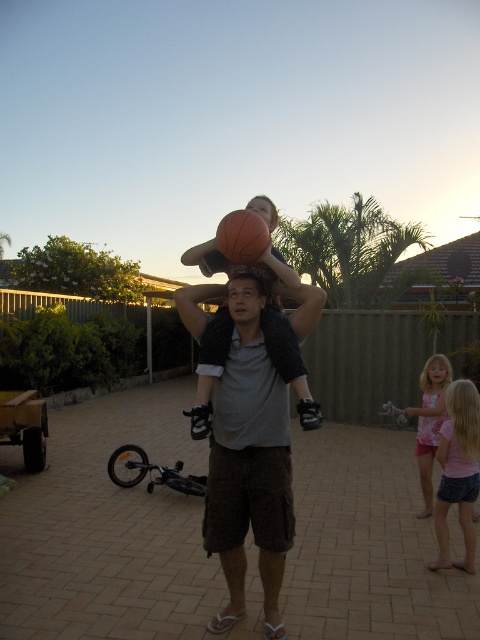
Question: Which of the following is the farthest from the observer?

Choices:
 (A) matte black shirt at center
 (B) pink fabric dress at lower right
 (C) matte gray head at center

Answer: (B)

Question: Is orange matte basketball at center positioned in front of matte gray head at center?

Choices:
 (A) no
 (B) yes

Answer: (B)

Question: Does gray cotton shirt at center appear under pink denim shorts at lower right?

Choices:
 (A) yes
 (B) no

Answer: (B)

Question: Estimate the real-world distances between objects in this image. Which object is closer to the gray cotton shirt at center?

Choices:
 (A) pink denim shorts at lower right
 (B) matte orange basketball at center
 (C) matte gray head at center
 (D) matte black shirt at center

Answer: (D)

Question: Is matte black shirt at center smaller than orange matte basketball at center?

Choices:
 (A) yes
 (B) no

Answer: (B)

Question: Which object appears closest to the camera in this image?

Choices:
 (A) matte orange basketball at center
 (B) matte black shirt at center
 (C) gray cotton shirt at center

Answer: (B)